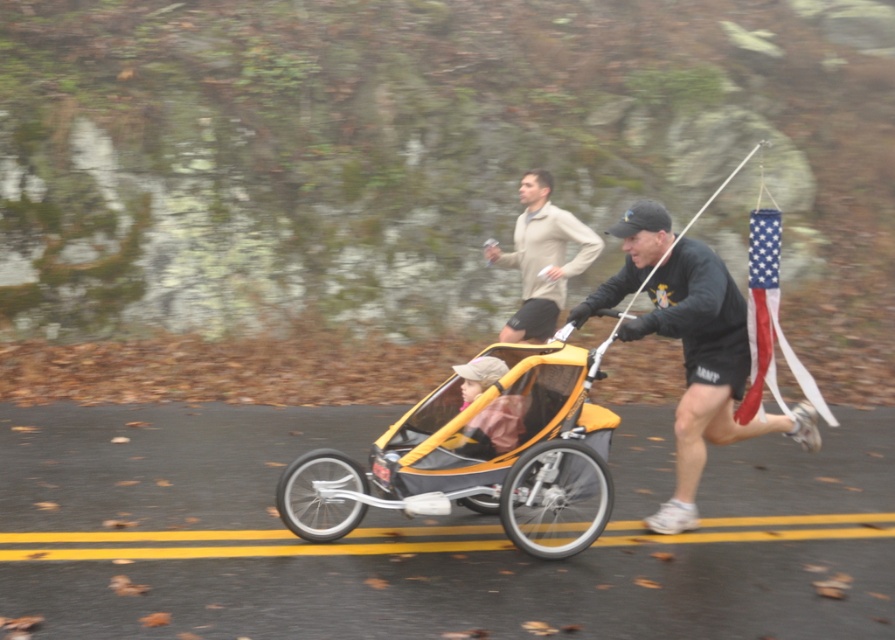
Question: From the image, what is the correct spatial relationship of black matte running shoe at lower right in relation to light beige sweater at center?

Choices:
 (A) above
 (B) below

Answer: (B)

Question: Is yellow fabric baby carriage at center thinner than light beige sweater at center?

Choices:
 (A) no
 (B) yes

Answer: (A)

Question: Which of the following is the farthest from the observer?

Choices:
 (A) (64, 541)
 (B) (534, 305)
 (C) (695, 388)

Answer: (B)

Question: Which of the following is the farthest from the observer?

Choices:
 (A) (751, 540)
 (B) (799, 372)

Answer: (B)

Question: Does light beige sweater at center appear over american flag fabric at right?

Choices:
 (A) no
 (B) yes

Answer: (B)

Question: Which is farther from the yellow solid lines at center?

Choices:
 (A) yellow fabric baby carriage at center
 (B) american flag fabric at right
 (C) light beige sweater at center

Answer: (C)